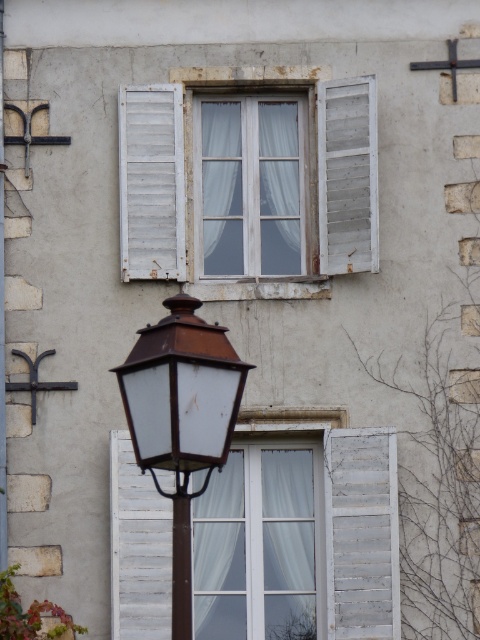
Question: Based on their relative distances, which object is farther from the white sheer curtain at center?

Choices:
 (A) white wooden shutter at upper left
 (B) white wooden shutter at right
 (C) brown matte street light at lower center

Answer: (B)

Question: Is brown matte street light at lower center smaller than white wooden shutter at right?

Choices:
 (A) no
 (B) yes

Answer: (A)

Question: Can you confirm if brown matte street light at lower center is positioned above white wooden shutter at right?

Choices:
 (A) no
 (B) yes

Answer: (A)

Question: Estimate the real-world distances between objects in this image. Which object is farther from the white wooden window at center?

Choices:
 (A) brown matte street light at lower center
 (B) white wooden shutter at upper left
 (C) white sheer curtain at center

Answer: (A)

Question: Which point is closer to the camera?

Choices:
 (A) (169, 452)
 (B) (342, 168)
 (C) (345, 211)

Answer: (A)

Question: Can you confirm if white sheer curtain at center is smaller than brown matte street light at lower center?

Choices:
 (A) yes
 (B) no

Answer: (A)